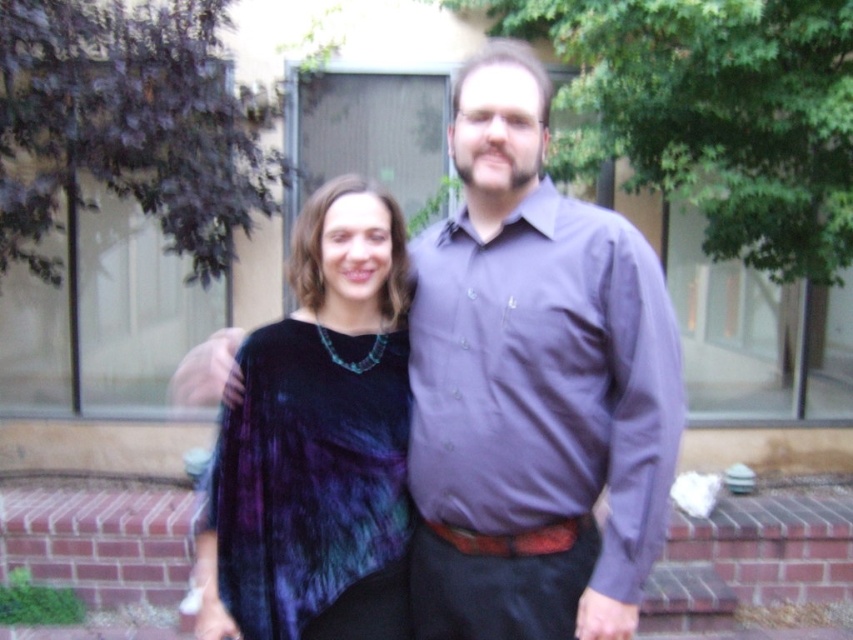
Question: Does velvet black dress at center appear under purple cotton shirt at center?

Choices:
 (A) yes
 (B) no

Answer: (B)

Question: Can you confirm if purple cotton shirt at center is positioned to the right of velvet tie-dye dress at center?

Choices:
 (A) no
 (B) yes

Answer: (B)

Question: Which point is farther to the camera?

Choices:
 (A) purple cotton shirt at center
 (B) velvet tie-dye dress at center

Answer: (B)

Question: Considering the real-world distances, which object is closest to the purple cotton shirt at center?

Choices:
 (A) velvet tie-dye dress at center
 (B) velvet black dress at center

Answer: (B)

Question: Among these objects, which one is farthest from the camera?

Choices:
 (A) velvet black dress at center
 (B) purple cotton shirt at center
 (C) velvet tie-dye dress at center

Answer: (C)

Question: Considering the relative positions of velvet black dress at center and velvet tie-dye dress at center in the image provided, where is velvet black dress at center located with respect to velvet tie-dye dress at center?

Choices:
 (A) left
 (B) right

Answer: (B)